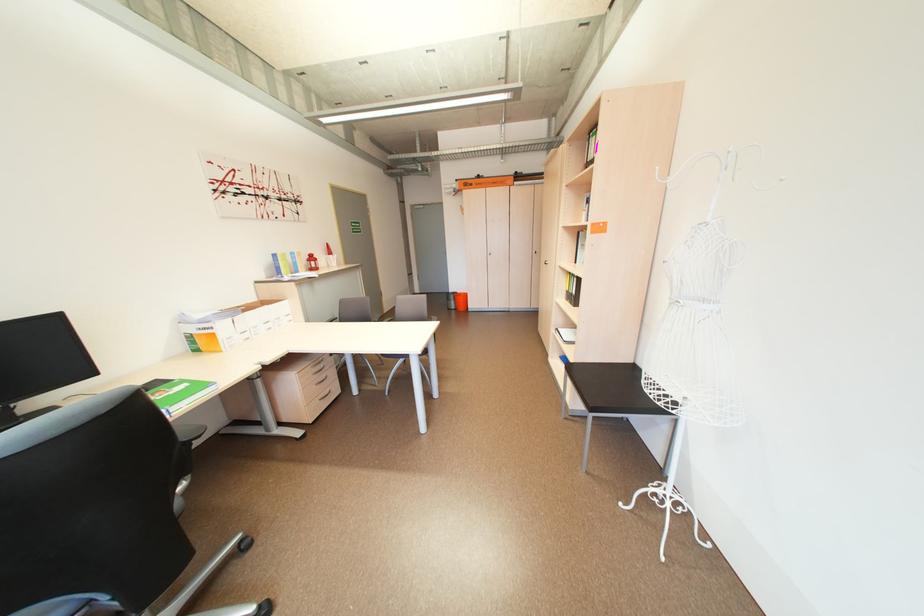
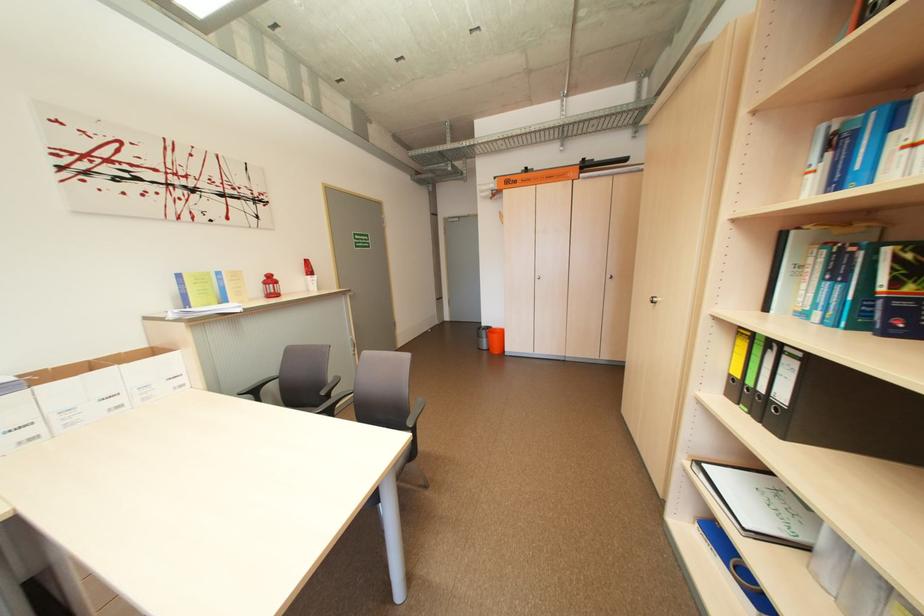
Question: The images are taken continuously from a first-person perspective. In which direction are you moving?

Choices:
 (A) Left
 (B) Right
 (C) Forward
 (D) Backward

Answer: (C)